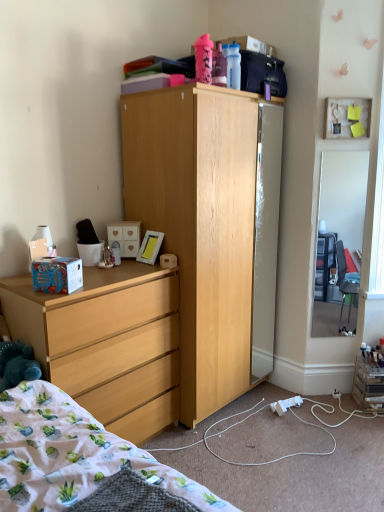
Locate an element on the screen. empty space that is ontop of fluffy cotton blanket at lower left is located at coordinates (276, 423).